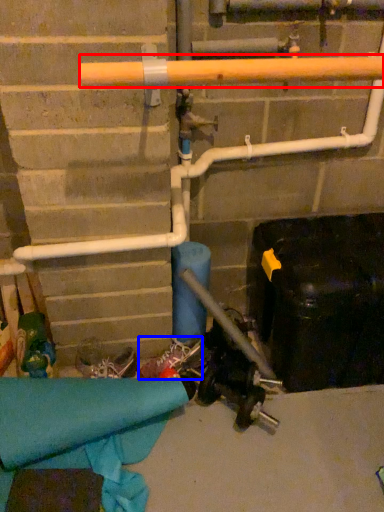
Question: Which of the following is the closest to the observer, beam (highlighted by a red box) or footwear (highlighted by a blue box)?

Choices:
 (A) beam
 (B) footwear

Answer: (A)